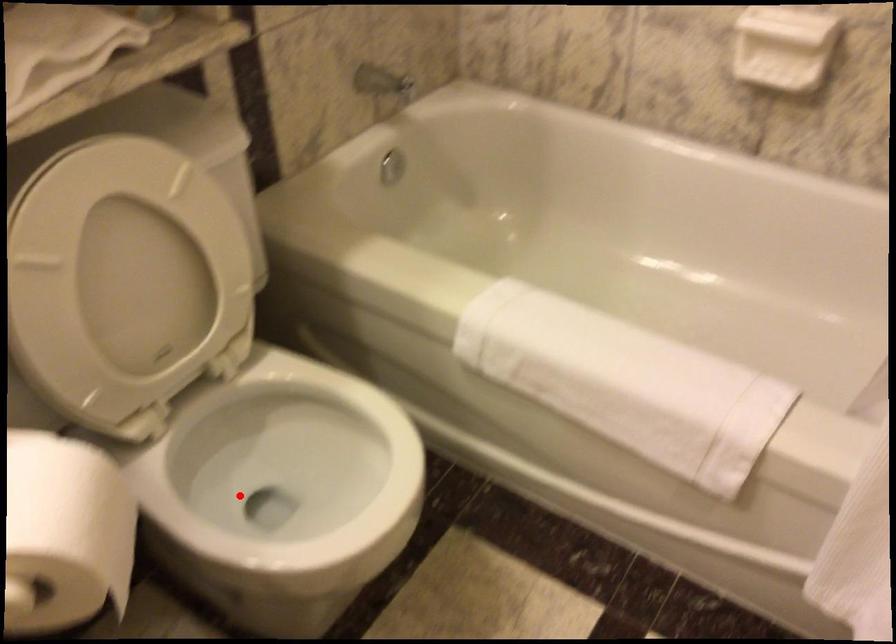
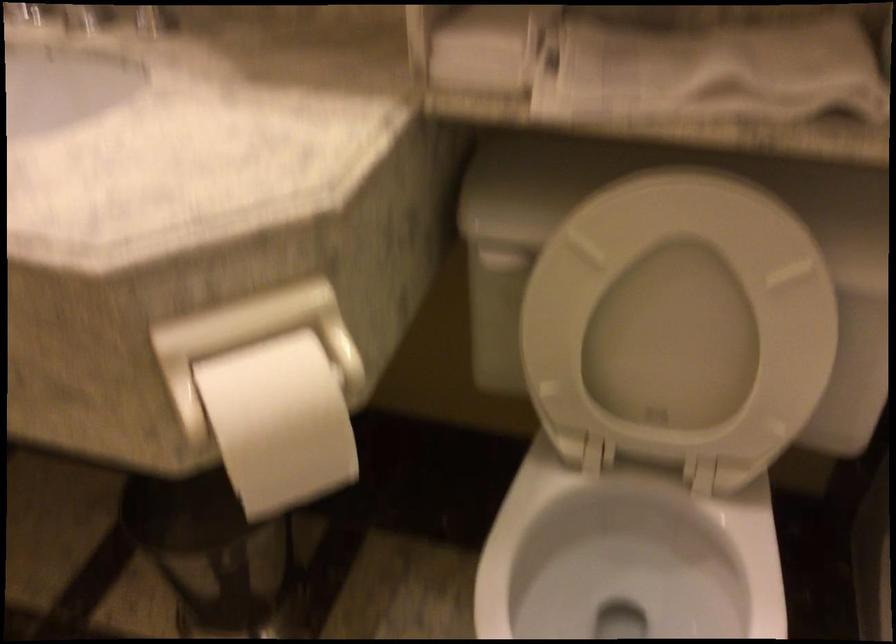
Find the pixel in the second image that matches the highlighted location in the first image.

(609, 574)